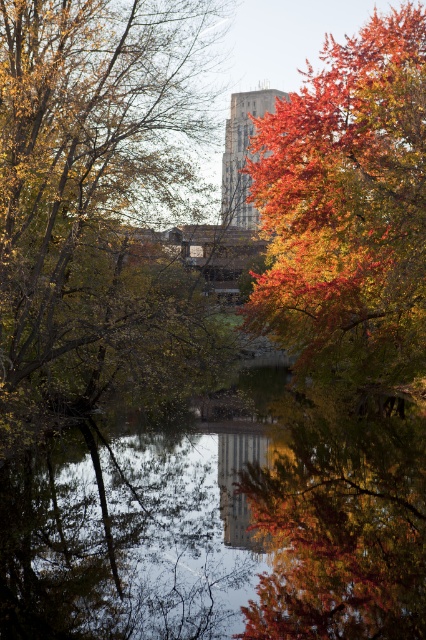
Can you confirm if transparent glass water at center is smaller than smooth concrete tower at center?

No, transparent glass water at center is not smaller than smooth concrete tower at center.

Is transparent glass water at center above smooth concrete tower at center?

Actually, transparent glass water at center is below smooth concrete tower at center.

Where is `transparent glass water at center`? The width and height of the screenshot is (426, 640). transparent glass water at center is located at coordinates (222, 520).

Where is `transparent glass water at center`? The height and width of the screenshot is (640, 426). transparent glass water at center is located at coordinates pyautogui.click(x=222, y=520).

Which is above, transparent glass water at center or shiny red leaves at upper right?

Positioned higher is shiny red leaves at upper right.

From the picture: Is transparent glass water at center to the right of shiny red leaves at upper right from the viewer's perspective?

Incorrect, transparent glass water at center is not on the right side of shiny red leaves at upper right.

Between point (393, 458) and point (357, 250), which one is positioned in front?

Positioned in front is point (393, 458).

Find the location of a particular element. transparent glass water at center is located at coordinates (222, 520).

Does point (313, 442) come in front of point (137, 163)?

No, (313, 442) is behind (137, 163).

Does transparent glass water at center have a greater width compared to autumn leaves at center?

Indeed, transparent glass water at center has a greater width compared to autumn leaves at center.

Describe the element at coordinates (222, 520) in the screenshot. The height and width of the screenshot is (640, 426). I see `transparent glass water at center` at that location.

At what (x,y) coordinates should I click in order to perform the action: click on transparent glass water at center. Please return your answer as a coordinate pair (x, y). The width and height of the screenshot is (426, 640). Looking at the image, I should click on (222, 520).